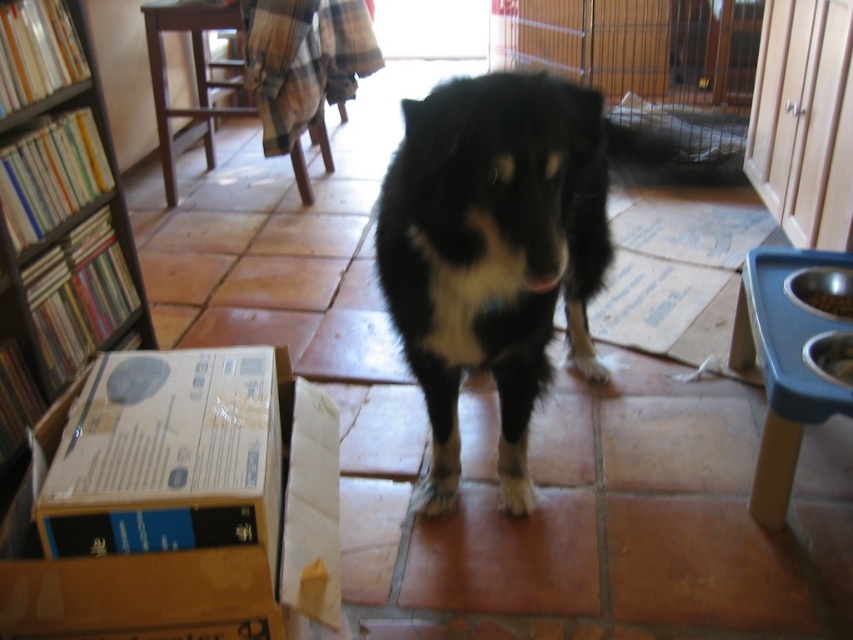
Question: Is wooden bookshelf at left further to the viewer compared to wooden cage at center?

Choices:
 (A) no
 (B) yes

Answer: (A)

Question: Among these points, which one is nearest to the camera?

Choices:
 (A) (519, 262)
 (B) (183, 556)
 (C) (65, 355)
 (D) (550, 22)

Answer: (B)

Question: Estimate the real-world distances between objects in this image. Which object is closer to the cardboard box at lower left?

Choices:
 (A) black fur dog at center
 (B) wooden bookshelf at left
 (C) wooden cage at center

Answer: (A)

Question: Is black fur dog at center to the left of wooden bookshelf at left from the viewer's perspective?

Choices:
 (A) no
 (B) yes

Answer: (A)

Question: Does black fur dog at center appear over wooden cage at center?

Choices:
 (A) no
 (B) yes

Answer: (A)

Question: Estimate the real-world distances between objects in this image. Which object is closer to the cardboard box at lower left?

Choices:
 (A) black fur dog at center
 (B) wooden bookshelf at left

Answer: (A)